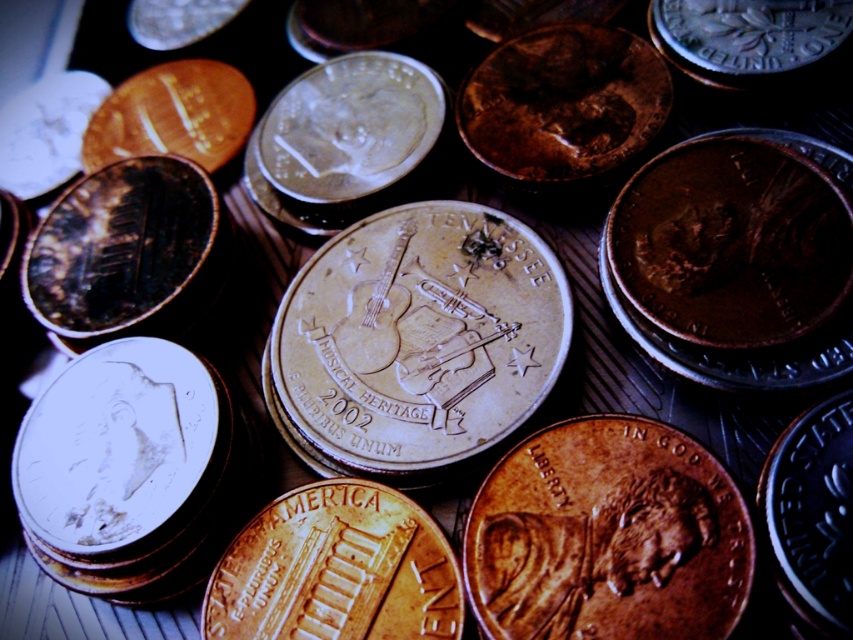
You are standing 5 feet away from the coins on the table. There is a point at coordinates point (143, 248). Can you reach that point without moving closer than 4 feet?

The distance of point (143, 248) from camera is 4.58 feet. Since you are standing 5 feet away, you can reach the point as it is within your 4 feet minimum distance requirement.